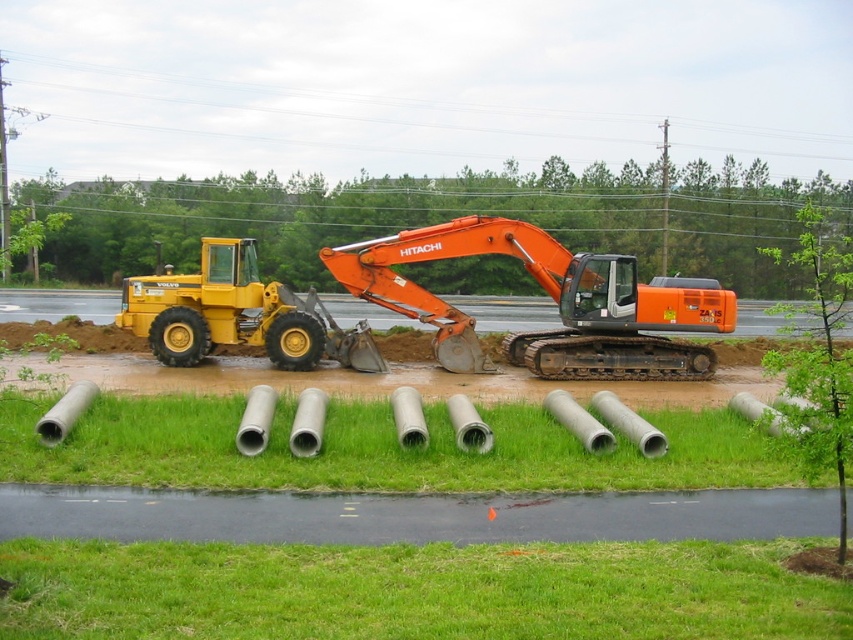
Does green concrete pipes at lower center have a lesser height compared to yellow rubber tractor at left?

Yes.

The image size is (853, 640). What do you see at coordinates (381, 449) in the screenshot?
I see `green concrete pipes at lower center` at bounding box center [381, 449].

Find the location of `green concrete pipes at lower center`. green concrete pipes at lower center is located at coordinates (381, 449).

Locate an element on the screen. green concrete pipes at lower center is located at coordinates (381, 449).

Can you confirm if green grass at lower center is positioned to the left of orange metallic excavator at center?

Correct, you'll find green grass at lower center to the left of orange metallic excavator at center.

Can you confirm if green grass at lower center is positioned below orange metallic excavator at center?

Correct, green grass at lower center is located below orange metallic excavator at center.

Who is more distant from viewer, (723, 609) or (643, 372)?

The point (643, 372) is behind.

The height and width of the screenshot is (640, 853). Find the location of `green grass at lower center`. green grass at lower center is located at coordinates (416, 589).

Is green grass at lower center wider than green concrete pipes at lower center?

Yes, green grass at lower center is wider than green concrete pipes at lower center.

Does green grass at lower center appear under green concrete pipes at lower center?

Yes, green grass at lower center is below green concrete pipes at lower center.

Is point (543, 570) positioned in front of point (579, 474)?

Yes, it is in front of point (579, 474).

Find the location of `green grass at lower center`. green grass at lower center is located at coordinates (416, 589).